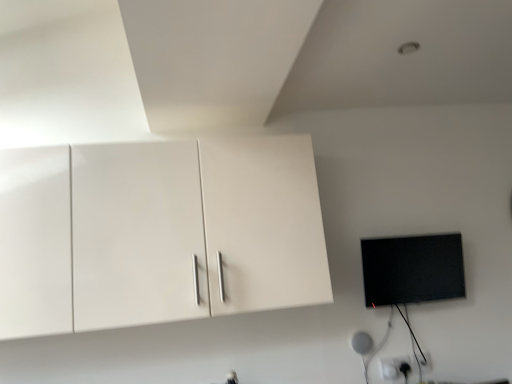
Question: Considering the relative sizes of black glossy flat screen tv at right and white glossy cabinet at upper left in the image provided, is black glossy flat screen tv at right shorter than white glossy cabinet at upper left?

Choices:
 (A) yes
 (B) no

Answer: (A)

Question: Does black glossy flat screen tv at right have a lesser width compared to white glossy cabinet at upper left?

Choices:
 (A) yes
 (B) no

Answer: (A)

Question: Is black glossy flat screen tv at right bigger than white glossy cabinet at upper left?

Choices:
 (A) no
 (B) yes

Answer: (A)

Question: Can we say black glossy flat screen tv at right lies outside white glossy cabinet at upper left?

Choices:
 (A) no
 (B) yes

Answer: (B)

Question: From the image's perspective, is black glossy flat screen tv at right beneath white glossy cabinet at upper left?

Choices:
 (A) no
 (B) yes

Answer: (B)

Question: Is black glossy flat screen tv at right facing towards white glossy cabinet at upper left?

Choices:
 (A) yes
 (B) no

Answer: (B)

Question: Can you confirm if white glossy cabinet at upper left is wider than black glossy flat screen tv at right?

Choices:
 (A) no
 (B) yes

Answer: (B)

Question: From a real-world perspective, is white glossy cabinet at upper left below black glossy flat screen tv at right?

Choices:
 (A) yes
 (B) no

Answer: (B)

Question: Is white glossy cabinet at upper left at the right side of black glossy flat screen tv at right?

Choices:
 (A) yes
 (B) no

Answer: (B)

Question: Is white glossy cabinet at upper left taller than black glossy flat screen tv at right?

Choices:
 (A) yes
 (B) no

Answer: (A)

Question: Is white glossy cabinet at upper left far from black glossy flat screen tv at right?

Choices:
 (A) no
 (B) yes

Answer: (A)

Question: From the image's perspective, is white glossy cabinet at upper left located beneath black glossy flat screen tv at right?

Choices:
 (A) no
 (B) yes

Answer: (A)

Question: Is black glossy flat screen tv at right inside the boundaries of white glossy cabinet at upper left, or outside?

Choices:
 (A) inside
 (B) outside

Answer: (B)